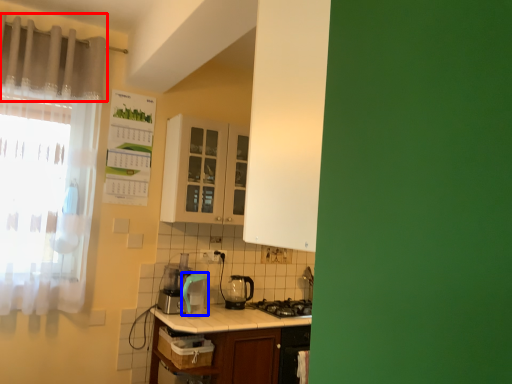
Question: Which point is further to the camera, curtain (highlighted by a red box) or appliance (highlighted by a blue box)?

Choices:
 (A) curtain
 (B) appliance

Answer: (B)